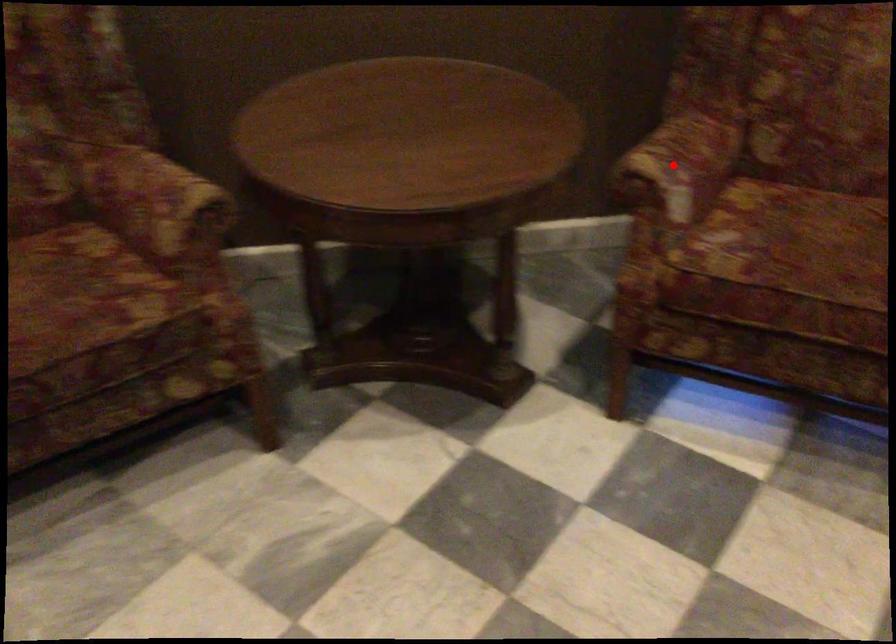
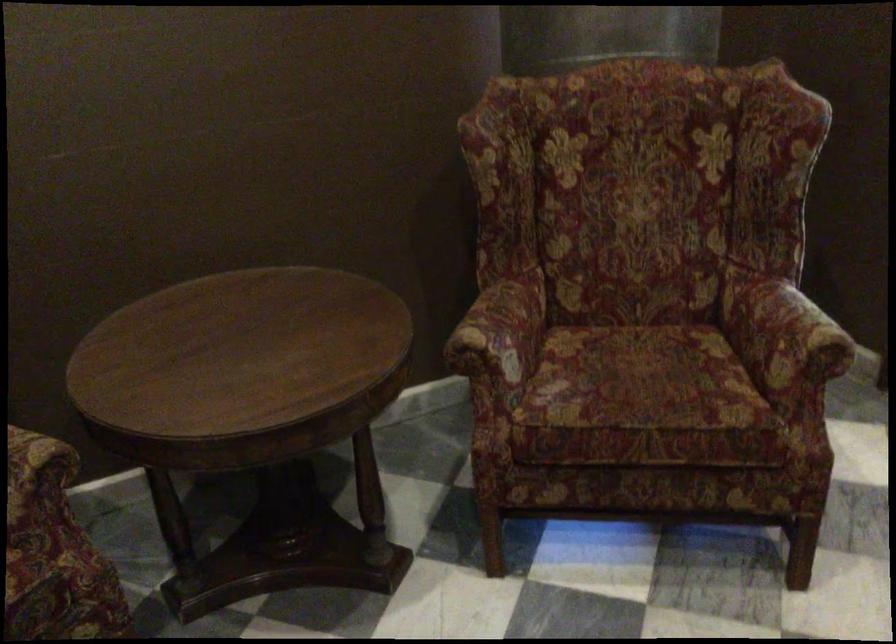
In the second image, find the point that corresponds to the highlighted location in the first image.

(501, 330)